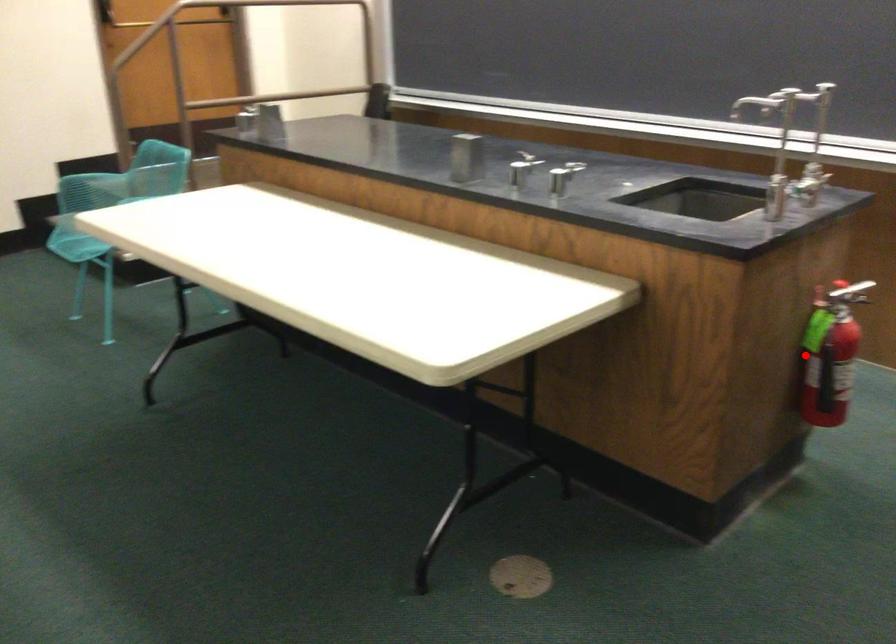
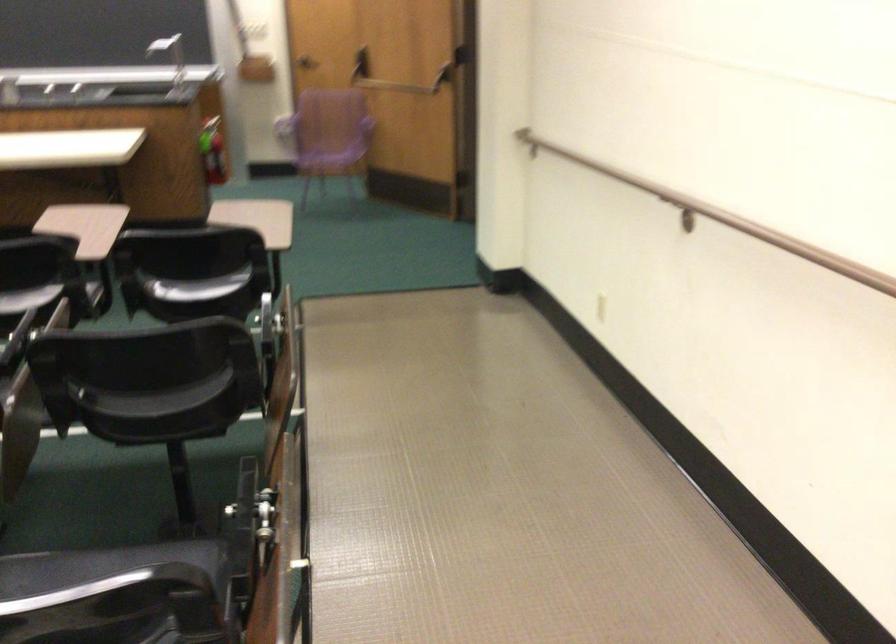
Find the pixel in the second image that matches the highlighted location in the first image.

(212, 151)